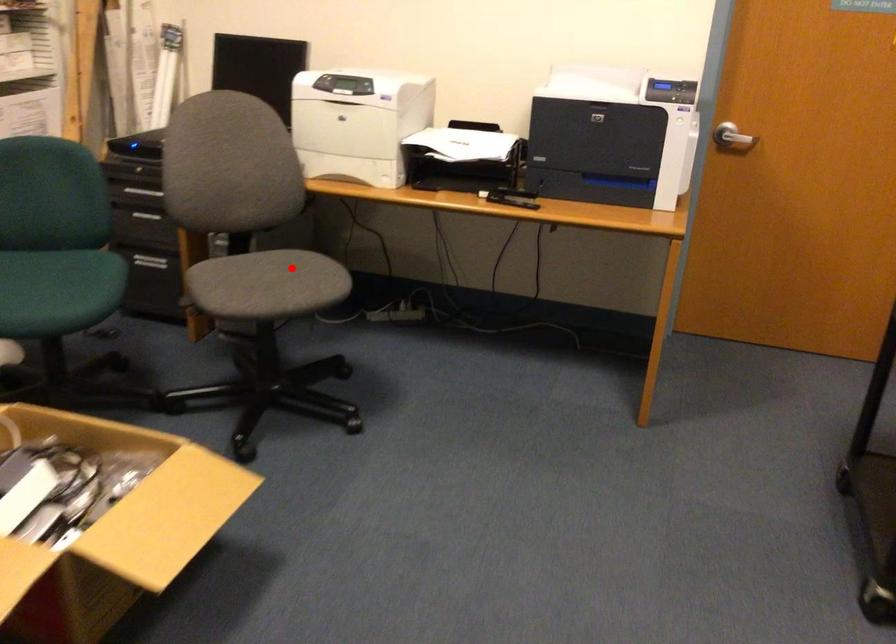
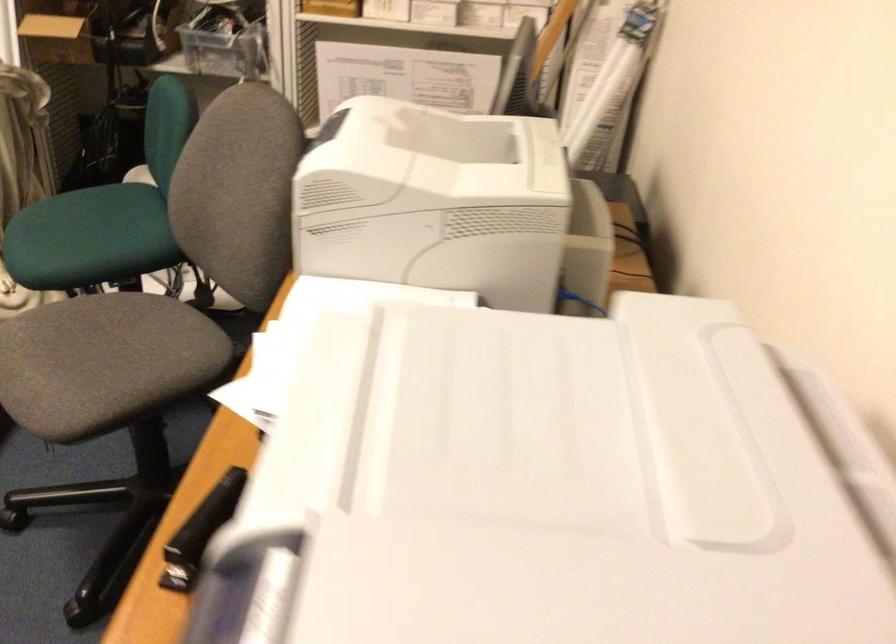
Find the pixel in the second image that matches the highlighted location in the first image.

(105, 363)